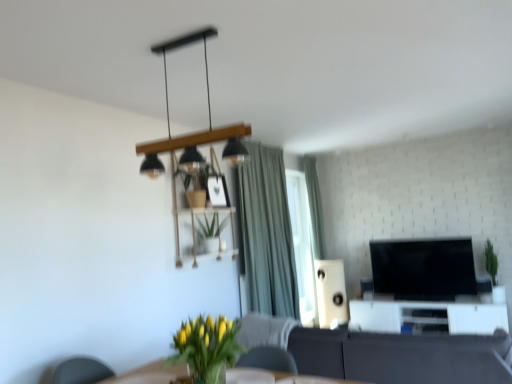
Question: Is white glossy entertainment center at lower right wider than green fabric curtain at upper center?

Choices:
 (A) no
 (B) yes

Answer: (B)

Question: Does white glossy entertainment center at lower right appear on the right side of green fabric curtain at upper center?

Choices:
 (A) yes
 (B) no

Answer: (A)

Question: Can you confirm if white glossy entertainment center at lower right is positioned to the left of green fabric curtain at upper center?

Choices:
 (A) yes
 (B) no

Answer: (B)

Question: From the image's perspective, is white glossy entertainment center at lower right above green fabric curtain at upper center?

Choices:
 (A) no
 (B) yes

Answer: (A)

Question: Does white glossy entertainment center at lower right have a lesser width compared to green fabric curtain at upper center?

Choices:
 (A) no
 (B) yes

Answer: (A)

Question: From a real-world perspective, relative to dark gray fabric couch at center, is matte black pendant light at upper center vertically above or below?

Choices:
 (A) below
 (B) above

Answer: (B)

Question: Is matte black pendant light at upper center inside or outside of dark gray fabric couch at center?

Choices:
 (A) inside
 (B) outside

Answer: (B)

Question: Is point (219, 178) closer or farther from the camera than point (339, 349)?

Choices:
 (A) closer
 (B) farther

Answer: (B)

Question: Is matte black pendant light at upper center wider or thinner than dark gray fabric couch at center?

Choices:
 (A) wide
 (B) thin

Answer: (B)

Question: From a real-world perspective, relative to green matte plant at right, is white glossy entertainment center at lower right vertically above or below?

Choices:
 (A) below
 (B) above

Answer: (A)

Question: Considering the positions of white glossy entertainment center at lower right and green matte plant at right in the image, is white glossy entertainment center at lower right wider or thinner than green matte plant at right?

Choices:
 (A) wide
 (B) thin

Answer: (A)

Question: Is white glossy entertainment center at lower right in front of or behind green matte plant at right in the image?

Choices:
 (A) front
 (B) behind

Answer: (A)

Question: From their relative heights in the image, would you say white glossy entertainment center at lower right is taller or shorter than green matte plant at right?

Choices:
 (A) tall
 (B) short

Answer: (B)

Question: From the image's perspective, is black glossy tv at center right positioned above or below matte black pendant light at upper center?

Choices:
 (A) above
 (B) below

Answer: (B)

Question: Considering the positions of black glossy tv at center right and matte black pendant light at upper center in the image, is black glossy tv at center right bigger or smaller than matte black pendant light at upper center?

Choices:
 (A) big
 (B) small

Answer: (A)